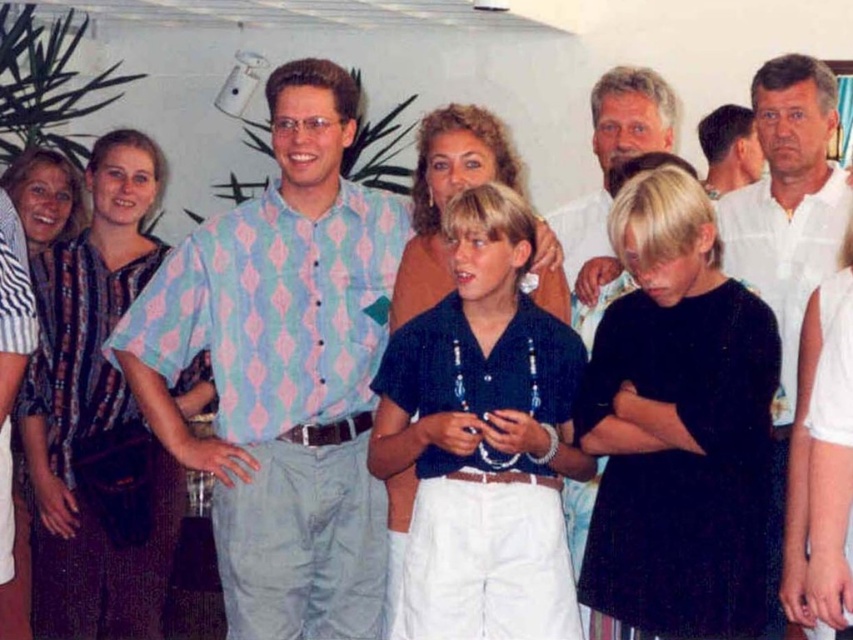
Question: Is the position of light brown wood face at center more distant than that of striped fabric dress at left?

Choices:
 (A) no
 (B) yes

Answer: (A)

Question: Is white cotton shirt at upper right closer to the viewer compared to light brown wood face at center?

Choices:
 (A) no
 (B) yes

Answer: (B)

Question: Which of these objects is positioned farthest from the matte brown blouse at center?

Choices:
 (A) striped fabric dress at left
 (B) black matte dress at center
 (C) white cotton shirt at upper right
 (D) pink diamond-patterned shirt at center

Answer: (A)

Question: Which of the following is the farthest from the observer?

Choices:
 (A) (764, 177)
 (B) (26, 157)

Answer: (A)

Question: Which point is closer to the camera?

Choices:
 (A) (444, 288)
 (B) (50, 182)

Answer: (A)

Question: Is pink diamond-patterned shirt at center above light brown wood face at center?

Choices:
 (A) yes
 (B) no

Answer: (B)